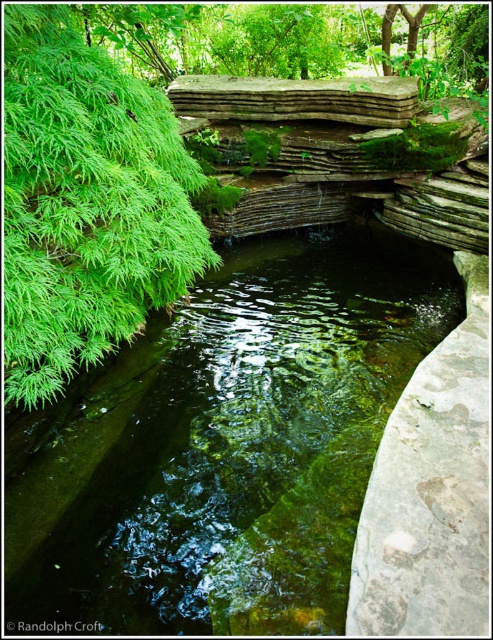
Question: Which object appears farthest from the camera in this image?

Choices:
 (A) green leafy plant at left
 (B) green mossy stone at center

Answer: (A)

Question: Considering the relative positions of green mossy stone at center and green leafy plant at left in the image provided, where is green mossy stone at center located with respect to green leafy plant at left?

Choices:
 (A) left
 (B) right

Answer: (B)

Question: Can you confirm if green mossy stone at center is positioned to the left of green leafy plant at left?

Choices:
 (A) yes
 (B) no

Answer: (B)

Question: Which object is farther from the camera taking this photo?

Choices:
 (A) green leafy plant at left
 (B) green mossy stone at center

Answer: (A)

Question: Is green mossy stone at center to the right of green leafy plant at left from the viewer's perspective?

Choices:
 (A) yes
 (B) no

Answer: (A)